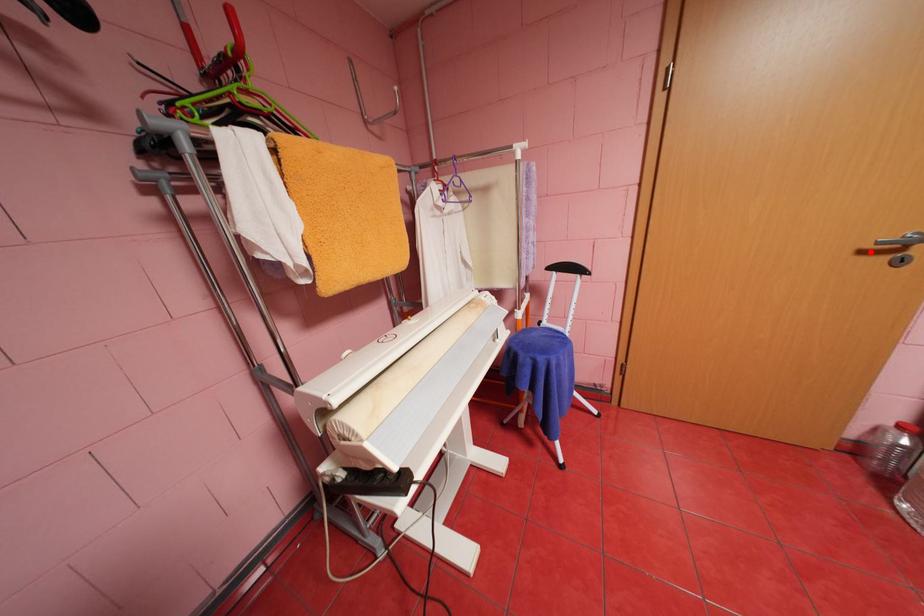
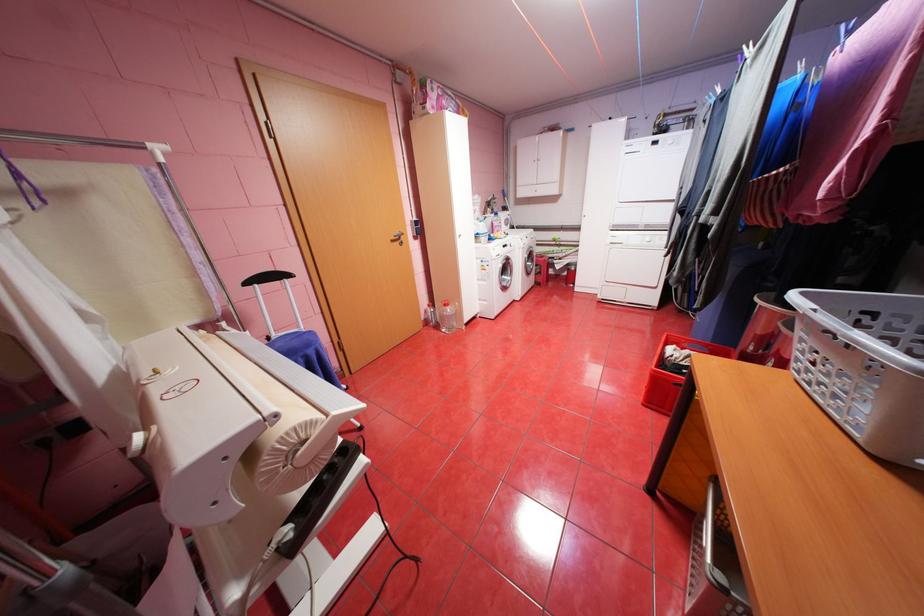
Question: I am providing you with two images of the same scene from different viewpoints. Given a red point in image1, look at the same physical point in image2. Is it:

Choices:
 (A) Closer to the viewpoint
 (B) Farther from the viewpoint

Answer: (A)